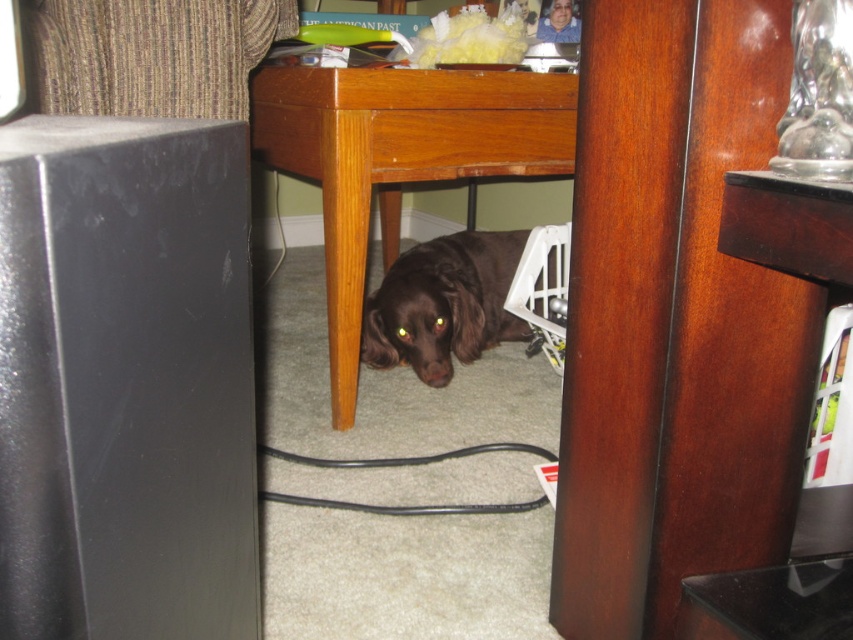
Who is lower down, wooden table at center or shiny brown dog at lower center?

shiny brown dog at lower center is below.

Who is shorter, wooden table at center or shiny brown dog at lower center?

shiny brown dog at lower center is shorter.

Does point (344, 230) come farther from viewer compared to point (405, 339)?

No, it is not.

Where is `wooden table at center`? The image size is (853, 640). wooden table at center is located at coordinates (398, 160).